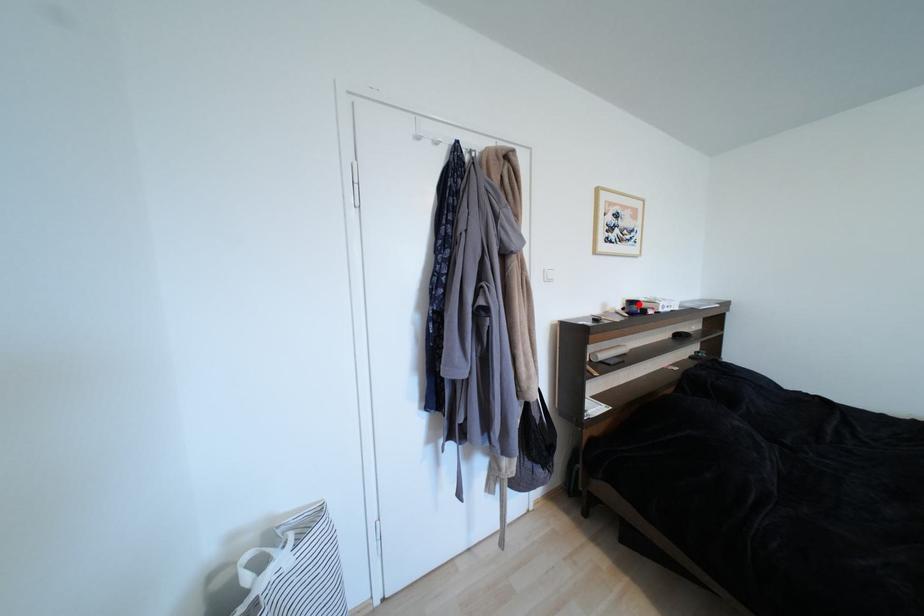
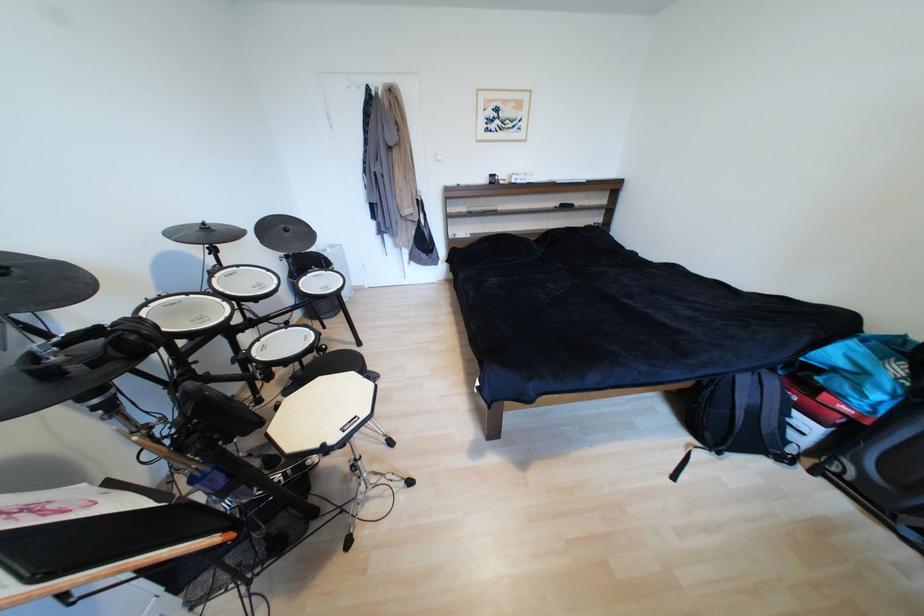
Question: I am providing you with two images of the same scene from different viewpoints. Image1 has a red point marked. In image2, the corresponding 3D location appears at what relative position? Reply with the corresponding letter.

Choices:
 (A) Closer
 (B) Farther

Answer: (A)